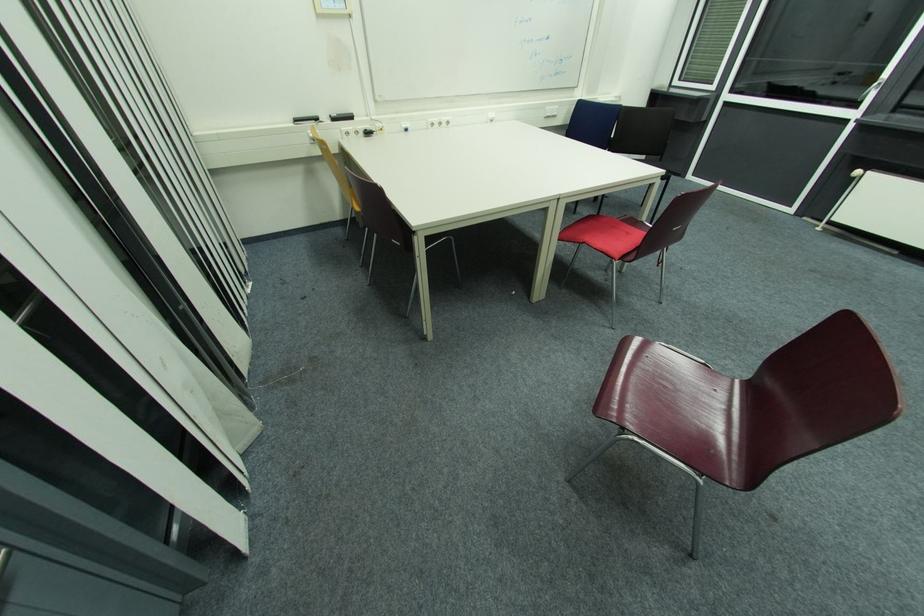
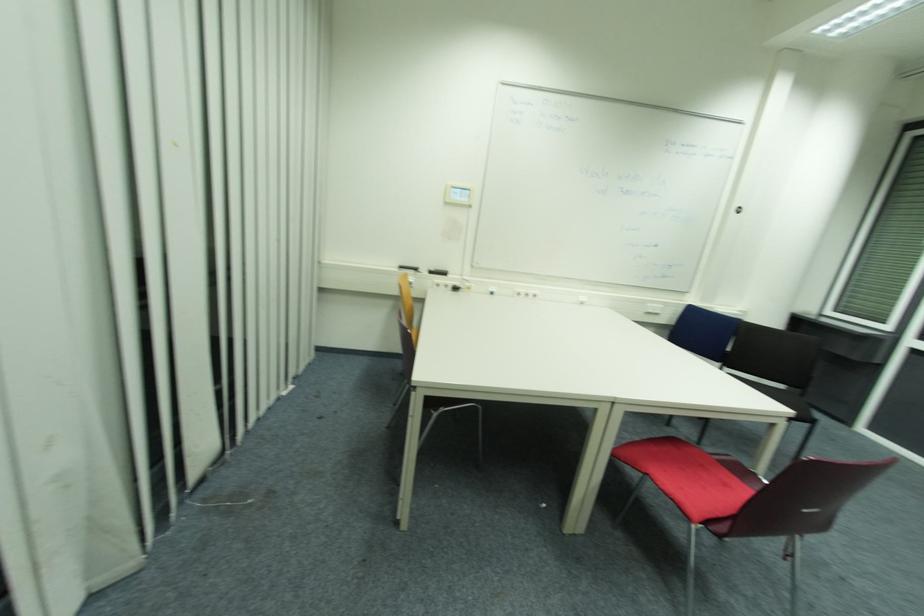
Locate, in the second image, the point that corresponds to the point at 615,259 in the first image.

(691, 519)